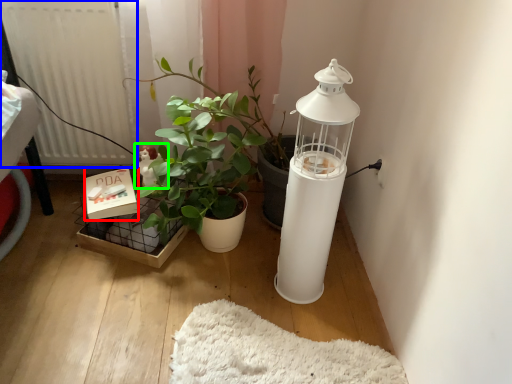
Question: Based on their relative distances, which object is nearer to box (highlighted by a red box)? Choose from radiator (highlighted by a blue box) and toy (highlighted by a green box).

Choices:
 (A) radiator
 (B) toy

Answer: (B)